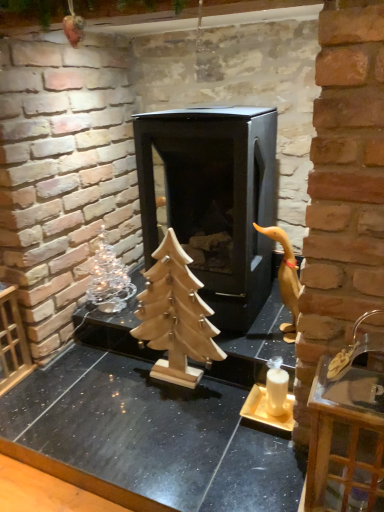
What is the approximate height of clear glass tray at right?

clear glass tray at right is 21.90 inches tall.

At what (x,y) coordinates should I click in order to perform the action: click on wooden tree at center. Please return your answer as a coordinate pair (x, y). The width and height of the screenshot is (384, 512). Looking at the image, I should click on pyautogui.click(x=148, y=438).

In order to face silver metallic christmas tree at left, should I rotate leftwards or rightwards?

You should rotate left by 11.678 degrees.

Identify the location of wooden duckling at right. The height and width of the screenshot is (512, 384). (286, 279).

This screenshot has width=384, height=512. Describe the element at coordinates (286, 279) in the screenshot. I see `wooden duckling at right` at that location.

Image resolution: width=384 pixels, height=512 pixels. I want to click on clear glass tray at right, so click(349, 435).

Does point (279, 401) appear closer or farther from the camera than point (230, 181)?

Point (279, 401) is positioned closer to the camera compared to point (230, 181).

Which object is positioned more to the right, white matte candle holder at lower right or black matte fireplace at center?

Positioned to the right is white matte candle holder at lower right.

Where is `candle holder below the black matte fireplace at center (from a real-world perspective)`? The height and width of the screenshot is (512, 384). candle holder below the black matte fireplace at center (from a real-world perspective) is located at coordinates (271, 399).

Can you tell me how much white matte candle holder at lower right and black matte fireplace at center differ in facing direction?

0.00147 degrees separate the facing orientations of white matte candle holder at lower right and black matte fireplace at center.

Considering the positions of objects silver metallic christmas tree at left and clear glass tray at right in the image provided, who is behind, silver metallic christmas tree at left or clear glass tray at right?

silver metallic christmas tree at left is further away from the camera.

Could you tell me if silver metallic christmas tree at left is facing clear glass tray at right?

No, silver metallic christmas tree at left is not facing towards clear glass tray at right.

Is point (108, 301) positioned behind point (348, 478)?

Yes.

Who is taller, silver metallic christmas tree at left or clear glass tray at right?

Standing taller between the two is clear glass tray at right.

Is wooden duckling at right to the right of white matte candle holder at lower right from the viewer's perspective?

Indeed, wooden duckling at right is positioned on the right side of white matte candle holder at lower right.

Where is `candle holder located on the left of wooden duckling at right`? This screenshot has width=384, height=512. candle holder located on the left of wooden duckling at right is located at coordinates (271, 399).

In the scene shown: Is wooden duckling at right oriented towards white matte candle holder at lower right?

Yes, wooden duckling at right is facing white matte candle holder at lower right.

From the image's perspective, is wooden duckling at right on top of white matte candle holder at lower right?

Yes.

This screenshot has width=384, height=512. What are the coordinates of `candle holder below the silver metallic christmas tree at left (from a real-world perspective)` in the screenshot? It's located at (271, 399).

Is white matte candle holder at lower right wider or thinner than silver metallic christmas tree at left?

In the image, white matte candle holder at lower right appears to be more narrow than silver metallic christmas tree at left.

Is white matte candle holder at lower right far from silver metallic christmas tree at left?

No.

Is white matte candle holder at lower right situated inside silver metallic christmas tree at left or outside?

white matte candle holder at lower right is located beyond the bounds of silver metallic christmas tree at left.

Is white matte candle holder at lower right placed right next to wooden duckling at right?

white matte candle holder at lower right and wooden duckling at right are not in contact.

From the image's perspective, is white matte candle holder at lower right located above or below wooden duckling at right?

white matte candle holder at lower right is situated lower than wooden duckling at right in the image.

Could wooden duckling at right be considered to be inside white matte candle holder at lower right?

No, wooden duckling at right is not a part of white matte candle holder at lower right.

Is wooden tree at center to the left of wooden christmas tree at center from the viewer's perspective?

Yes, wooden tree at center is to the left of wooden christmas tree at center.

Can you confirm if wooden tree at center is bigger than wooden christmas tree at center?

Indeed, wooden tree at center has a larger size compared to wooden christmas tree at center.

Between wooden tree at center and wooden christmas tree at center, which one has more height?

wooden christmas tree at center is taller.

Considering the sizes of objects wooden tree at center and wooden christmas tree at center in the image provided, who is wider, wooden tree at center or wooden christmas tree at center?

wooden tree at center is wider.

Could you tell me if wooden duckling at right is facing clear glass tray at right?

No.

From a real-world perspective, is wooden duckling at right positioned above or below clear glass tray at right?

Clearly, from a real-world perspective, wooden duckling at right is above clear glass tray at right.

Which object is thinner, wooden duckling at right or clear glass tray at right?

wooden duckling at right is thinner.

Is point (293, 300) closer to camera compared to point (333, 472)?

No, (293, 300) is behind (333, 472).

The width and height of the screenshot is (384, 512). Identify the location of fireplace lying on the left of white matte candle holder at lower right. (214, 200).

Where is `christmas decoration lying above the clear glass tray at right (from the image's perspective)`? Image resolution: width=384 pixels, height=512 pixels. christmas decoration lying above the clear glass tray at right (from the image's perspective) is located at coordinates (108, 279).

Estimate the real-world distances between objects in this image. Which object is further from clear glass tray at right, white matte candle holder at lower right or silver metallic christmas tree at left?

silver metallic christmas tree at left is further to clear glass tray at right.

Which object lies further to the anchor point wooden tree at center, white matte candle holder at lower right or silver metallic christmas tree at left?

Among the two, silver metallic christmas tree at left is located further to wooden tree at center.

Which object lies further to the anchor point silver metallic christmas tree at left, black matte fireplace at center or wooden christmas tree at center?

black matte fireplace at center is positioned further to the anchor silver metallic christmas tree at left.

Looking at the image, which one is located closer to wooden duckling at right, wooden tree at center or white matte candle holder at lower right?

The object closer to wooden duckling at right is white matte candle holder at lower right.

Estimate the real-world distances between objects in this image. Which object is further from wooden christmas tree at center, wooden duckling at right or silver metallic christmas tree at left?

wooden duckling at right is further to wooden christmas tree at center.

From the image, which object appears to be nearer to silver metallic christmas tree at left, clear glass tray at right or wooden christmas tree at center?

wooden christmas tree at center lies closer to silver metallic christmas tree at left than the other object.

Which object lies further to the anchor point wooden duckling at right, silver metallic christmas tree at left or clear glass tray at right?

The object further to wooden duckling at right is silver metallic christmas tree at left.

Looking at the image, which one is located further to silver metallic christmas tree at left, clear glass tray at right or white matte candle holder at lower right?

The object further to silver metallic christmas tree at left is clear glass tray at right.

This screenshot has width=384, height=512. What are the coordinates of `candle holder situated between silver metallic christmas tree at left and clear glass tray at right from left to right` in the screenshot? It's located at click(x=271, y=399).

The height and width of the screenshot is (512, 384). Identify the location of fireplace situated between silver metallic christmas tree at left and wooden duckling at right from left to right. (214, 200).

The width and height of the screenshot is (384, 512). Identify the location of fireplace between clear glass tray at right and wooden duckling at right along the z-axis. (214, 200).

At what (x,y) coordinates should I click in order to perform the action: click on christmas tree located between wooden tree at center and silver metallic christmas tree at left in the depth direction. Please return your answer as a coordinate pair (x, y). Looking at the image, I should click on (175, 316).